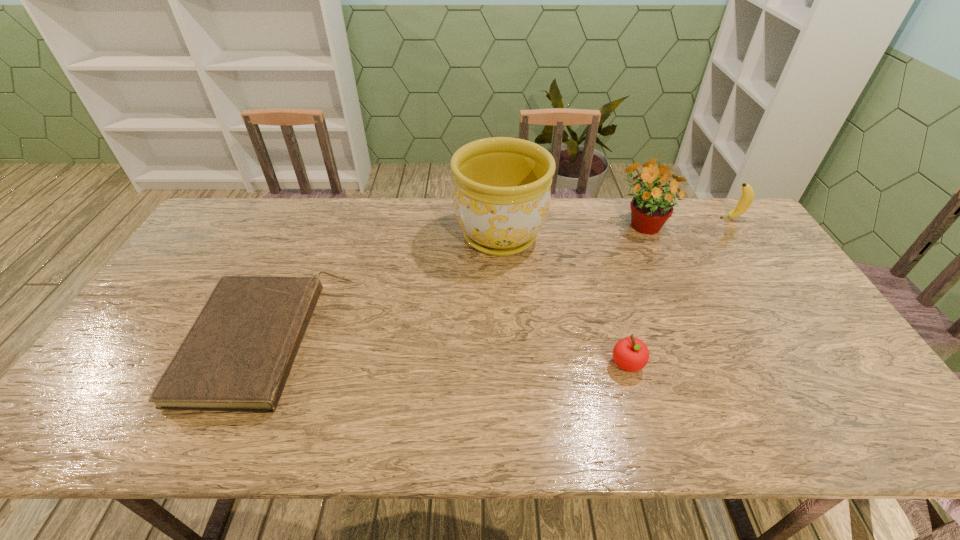
At what (x,y) coordinates should I click in order to perform the action: click on free region located 0.220m from the stem of the rightmost object. Please return your answer as a coordinate pair (x, y). The height and width of the screenshot is (540, 960). Looking at the image, I should click on (657, 218).

This screenshot has width=960, height=540. I want to click on free space located 0.400m from the stem of the rightmost object, so click(x=605, y=218).

Where is `blank area located from the stem of the rightmost object`? This screenshot has height=540, width=960. blank area located from the stem of the rightmost object is located at coordinates (651, 218).

Locate an element on the screen. free spot located 0.210m on the back of the apple is located at coordinates (606, 292).

Find the location of `blank space located 0.270m on the spine side of the shortest object`. blank space located 0.270m on the spine side of the shortest object is located at coordinates (444, 343).

The image size is (960, 540). Identify the location of banana situated at the far edge. (746, 199).

This screenshot has height=540, width=960. In order to click on object that is at the near edge in this screenshot , I will do `click(237, 356)`.

Where is `object that is at the right edge`? object that is at the right edge is located at coordinates (746, 199).

Where is `object at the far right corner`? This screenshot has height=540, width=960. object at the far right corner is located at coordinates [x=746, y=199].

Locate an element on the screen. vacant region at the far edge of the desktop is located at coordinates (448, 200).